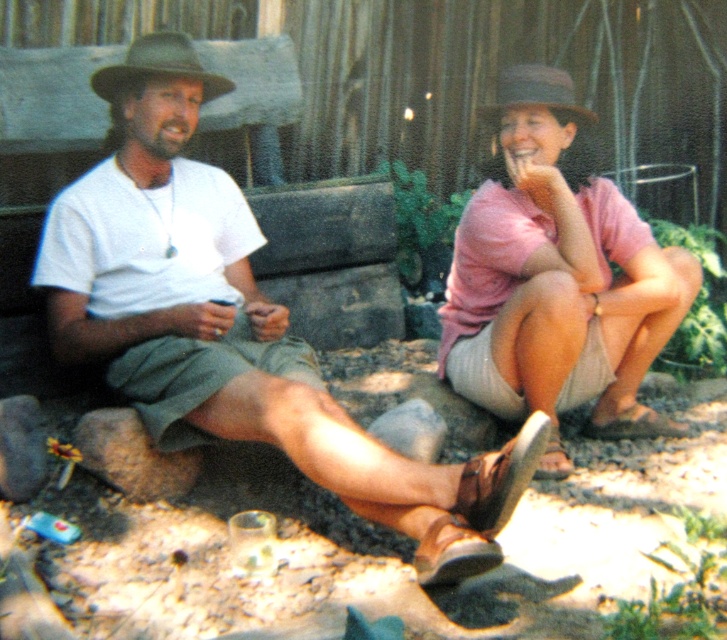
Can you confirm if matte khaki shorts at center is smaller than brown felt cowboy hat at upper left?

No, matte khaki shorts at center is not smaller than brown felt cowboy hat at upper left.

Between matte khaki shorts at center and brown felt cowboy hat at upper left, which one is positioned higher?

Positioned higher is brown felt cowboy hat at upper left.

Where is `matte khaki shorts at center`? The height and width of the screenshot is (640, 727). matte khaki shorts at center is located at coordinates (236, 339).

Image resolution: width=727 pixels, height=640 pixels. What are the coordinates of `matte khaki shorts at center` in the screenshot? It's located at (236, 339).

Who is lower down, matte khaki shorts at center or pink fabric shirt at upper right?

matte khaki shorts at center

I want to click on matte khaki shorts at center, so click(x=236, y=339).

Which is above, pink fabric shirt at upper right or gray felt cowboy hat at upper right?

Positioned higher is gray felt cowboy hat at upper right.

Is pink fabric shirt at upper right above gray felt cowboy hat at upper right?

No.

Between point (539, 224) and point (561, 115), which one is positioned behind?

Positioned behind is point (539, 224).

Where is `pink fabric shirt at upper right`? This screenshot has height=640, width=727. pink fabric shirt at upper right is located at coordinates [x=555, y=276].